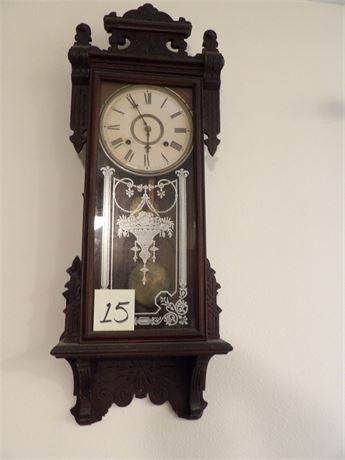
Find the location of a particular element. wall is located at coordinates (304, 273).